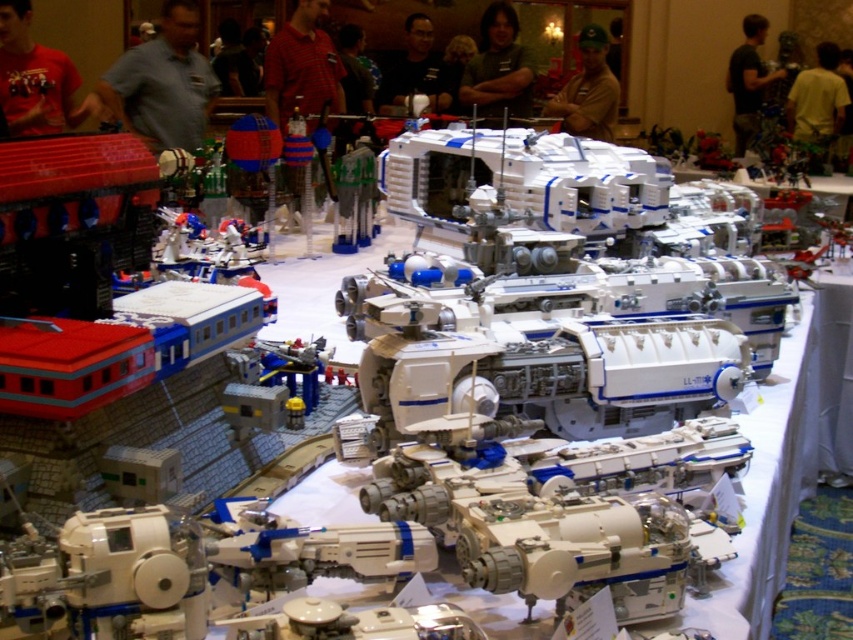
Does brown cap at center appear over matte black shirt at center?

Incorrect, brown cap at center is not positioned above matte black shirt at center.

Does brown cap at center have a greater width compared to matte black shirt at center?

No.

Is point (602, 61) farther from camera compared to point (426, 38)?

No, (602, 61) is in front of (426, 38).

Where is `brown cap at center`? The height and width of the screenshot is (640, 853). brown cap at center is located at coordinates (589, 90).

Does yellow matte shirt at upper right have a lesser width compared to dark brown shirt at upper right?

In fact, yellow matte shirt at upper right might be wider than dark brown shirt at upper right.

Does yellow matte shirt at upper right come behind dark brown shirt at upper right?

No.

What do you see at coordinates (817, 106) in the screenshot?
I see `yellow matte shirt at upper right` at bounding box center [817, 106].

You are a GUI agent. You are given a task and a screenshot of the screen. Output one action in this format:
    pyautogui.click(x=<x>, y=<y>)
    Task: Click on the yellow matte shirt at upper right
    
    Given the screenshot: What is the action you would take?
    pyautogui.click(x=817, y=106)

Which of these two, red plaid shirt at center or matte black shirt at center, stands taller?

Standing taller between the two is red plaid shirt at center.

Consider the image. Is red plaid shirt at center shorter than matte black shirt at center?

Incorrect, red plaid shirt at center's height does not fall short of matte black shirt at center's.

From the picture: Who is more forward, (316, 12) or (390, 104)?

Point (316, 12) is more forward.

Where is `red plaid shirt at center`? This screenshot has width=853, height=640. red plaid shirt at center is located at coordinates (302, 67).